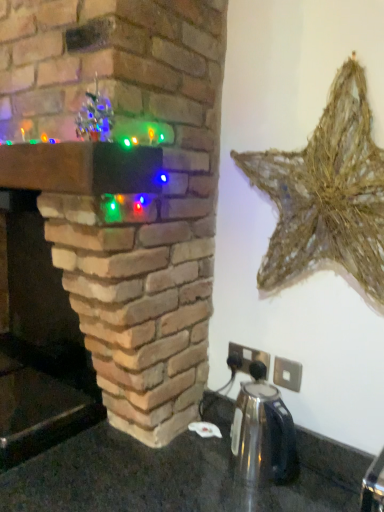
Question: From the image's perspective, is rustic straw star at upper right located beneath shiny metallic kettle at center?

Choices:
 (A) yes
 (B) no

Answer: (B)

Question: Does rustic straw star at upper right have a smaller size compared to shiny metallic kettle at center?

Choices:
 (A) no
 (B) yes

Answer: (A)

Question: Is rustic straw star at upper right looking in the opposite direction of shiny metallic kettle at center?

Choices:
 (A) yes
 (B) no

Answer: (B)

Question: Is rustic straw star at upper right in front of shiny metallic kettle at center?

Choices:
 (A) no
 (B) yes

Answer: (B)

Question: From the image's perspective, is rustic straw star at upper right on top of shiny metallic kettle at center?

Choices:
 (A) yes
 (B) no

Answer: (A)

Question: In terms of size, does shiny metallic kettle at center appear bigger or smaller than rustic straw star at upper right?

Choices:
 (A) big
 (B) small

Answer: (B)

Question: From the image's perspective, is shiny metallic kettle at center above or below rustic straw star at upper right?

Choices:
 (A) below
 (B) above

Answer: (A)

Question: Does point (281, 408) appear closer or farther from the camera than point (355, 69)?

Choices:
 (A) closer
 (B) farther

Answer: (B)

Question: Considering their positions, is shiny metallic kettle at center located in front of or behind rustic straw star at upper right?

Choices:
 (A) front
 (B) behind

Answer: (B)

Question: From a real-world perspective, relative to brick fireplace at center, is rustic straw star at upper right vertically above or below?

Choices:
 (A) below
 (B) above

Answer: (B)

Question: In terms of size, does rustic straw star at upper right appear bigger or smaller than brick fireplace at center?

Choices:
 (A) big
 (B) small

Answer: (B)

Question: Would you say rustic straw star at upper right is inside or outside brick fireplace at center?

Choices:
 (A) inside
 (B) outside

Answer: (B)

Question: Is rustic straw star at upper right taller or shorter than brick fireplace at center?

Choices:
 (A) short
 (B) tall

Answer: (A)

Question: Is shiny metallic kettle at center bigger or smaller than brick fireplace at center?

Choices:
 (A) small
 (B) big

Answer: (A)

Question: In terms of height, does shiny metallic kettle at center look taller or shorter compared to brick fireplace at center?

Choices:
 (A) tall
 (B) short

Answer: (B)